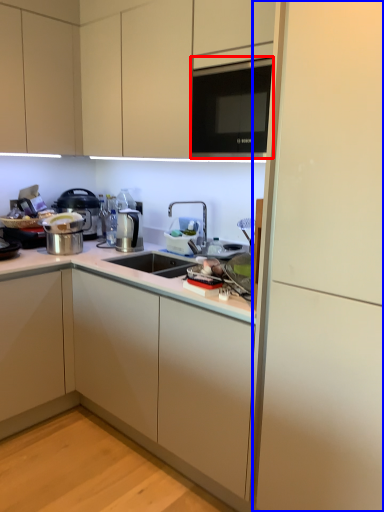
Question: Which object appears closest to the camera in this image, microwave (highlighted by a red box) or side (highlighted by a blue box)?

Choices:
 (A) microwave
 (B) side

Answer: (B)